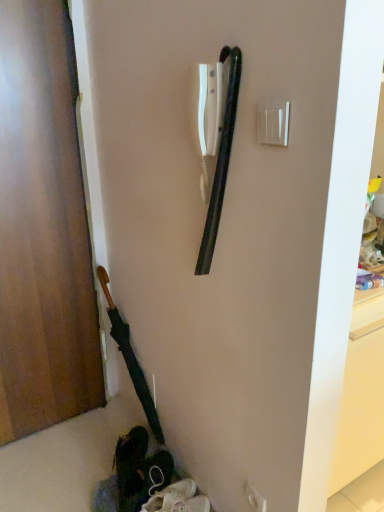
Question: Considering the positions of point (266, 115) and point (51, 156), is point (266, 115) closer or farther from the camera than point (51, 156)?

Choices:
 (A) closer
 (B) farther

Answer: (A)

Question: Relative to wooden door at left, is white plastic light switch at upper right in front or behind?

Choices:
 (A) behind
 (B) front

Answer: (B)

Question: Which is farther from the white plastic electric outlet at center?

Choices:
 (A) white plastic light switch at upper right
 (B) wooden door at left

Answer: (B)

Question: Estimate the real-world distances between objects in this image. Which object is closer to the white plastic light switch at upper right?

Choices:
 (A) white plastic electric outlet at center
 (B) wooden door at left

Answer: (A)